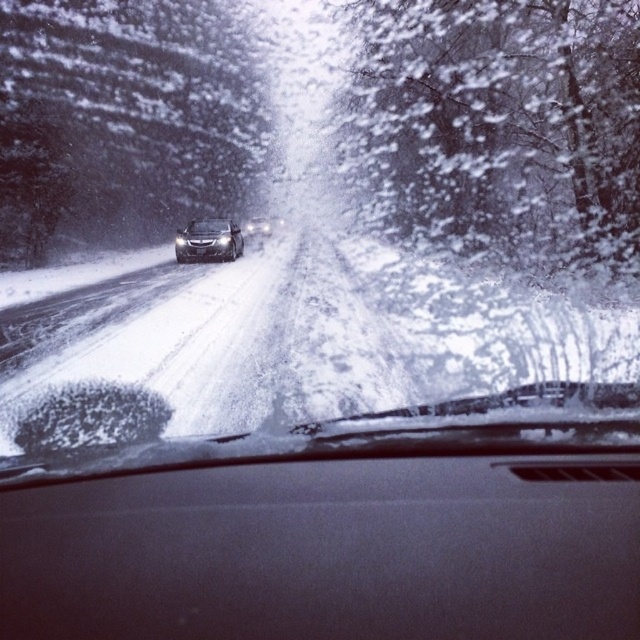
Between transparent glass windshield at center and sleek silver sedan at center, which one appears on the left side from the viewer's perspective?

Positioned to the left is sleek silver sedan at center.

Who is more distant from viewer, (49, 193) or (204, 243)?

Point (49, 193)

Between point (179, 291) and point (208, 220), which one is positioned in front?

Point (179, 291)

At what (x,y) coordinates should I click in order to perform the action: click on transparent glass windshield at center. Please return your answer as a coordinate pair (x, y). The width and height of the screenshot is (640, 640). Looking at the image, I should click on (317, 208).

Does point (212, 321) come farther from viewer compared to point (109, 493)?

Yes, point (212, 321) is behind point (109, 493).

How distant is transparent glass windshield at center from satin black dashboard at center?

transparent glass windshield at center and satin black dashboard at center are 15.23 meters apart.

Between point (330, 412) and point (406, 536), which one is positioned behind?

The point (330, 412) is more distant.

Where is `transparent glass windshield at center`? transparent glass windshield at center is located at coordinates (317, 208).

Between satin black dashboard at center and sleek silver sedan at center, which one is positioned lower?

satin black dashboard at center is below.

Is satin black dashboard at center shorter than sleek silver sedan at center?

Yes.

Locate an element on the screen. satin black dashboard at center is located at coordinates (330, 550).